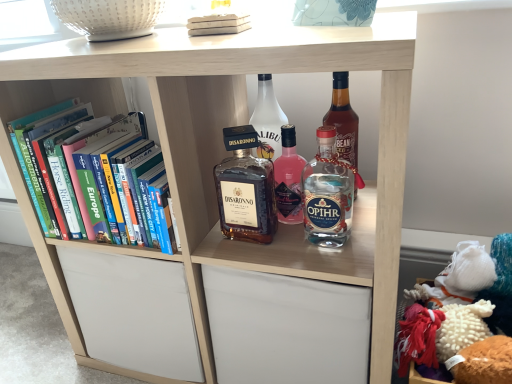
Question: Is clear glass bottle at center, which is the 1th bottle in right-to-left order, to the left or to the right of white matte book at upper center, positioned as the 1th book in right-to-left order, in the image?

Choices:
 (A) left
 (B) right

Answer: (B)

Question: From a real-world perspective, relative to white matte book at upper center, positioned as the 1th book in right-to-left order, is clear glass bottle at center, the third bottle when ordered from left to right, vertically above or below?

Choices:
 (A) below
 (B) above

Answer: (A)

Question: Considering the real-world distances, which object is farthest from the clear glass bottle at center, which is the 1th bottle in right-to-left order?

Choices:
 (A) white matte book at upper center, marked as the first book in a top-to-bottom arrangement
 (B) hardcover books at left, the second book positioned from the front
 (C) matte glass bottle at center, arranged as the first bottle when viewed from the left
 (D) white glass bottle at center, marked as the second bottle in a left-to-right arrangement

Answer: (B)

Question: Estimate the real-world distances between objects in this image. Which object is closer to the hardcover books at left, positioned as the first book in left-to-right order?

Choices:
 (A) clear glass bottle at center, the third bottle when ordered from left to right
 (B) matte glass bottle at center, arranged as the first bottle when viewed from the left
 (C) white glass bottle at center, acting as the 2th bottle starting from the right
 (D) white matte book at upper center, the second book viewed from the left

Answer: (B)